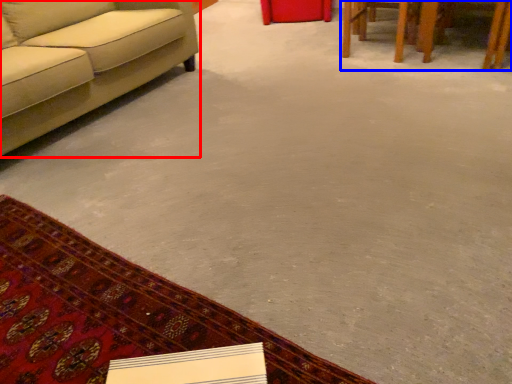
Question: Which of the following is the closest to the observer, studio couch (highlighted by a red box) or table (highlighted by a blue box)?

Choices:
 (A) studio couch
 (B) table

Answer: (A)